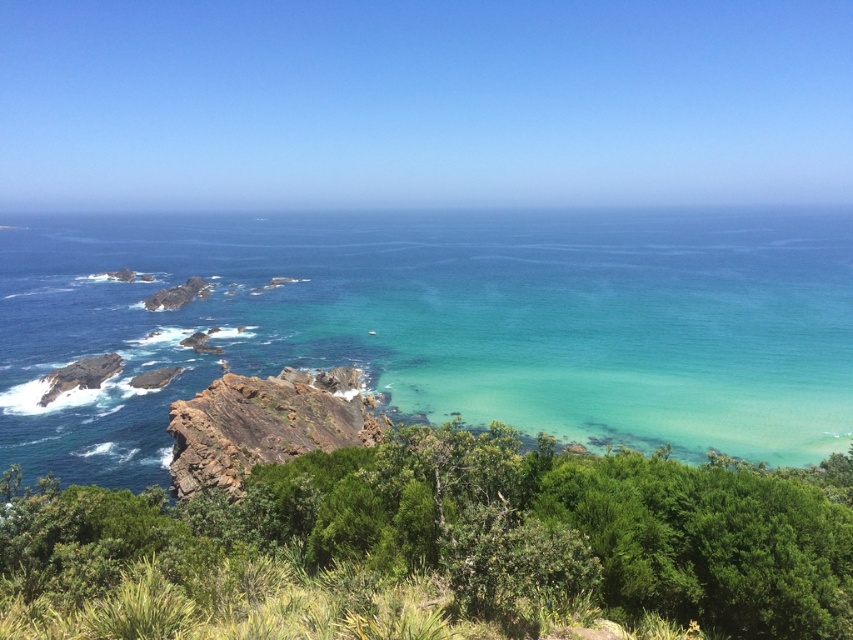
Question: Is clear blue water at center above rusty rock at center?

Choices:
 (A) yes
 (B) no

Answer: (A)

Question: Among these objects, which one is nearest to the camera?

Choices:
 (A) green leafy shrubs at lower center
 (B) clear blue water at center

Answer: (A)

Question: Estimate the real-world distances between objects in this image. Which object is closer to the green leafy shrubs at lower center?

Choices:
 (A) rusty rock at center
 (B) clear blue water at center

Answer: (A)

Question: Is clear blue water at center smaller than rusty rock at center?

Choices:
 (A) yes
 (B) no

Answer: (B)

Question: Does clear blue water at center come in front of green leafy shrubs at lower center?

Choices:
 (A) yes
 (B) no

Answer: (B)

Question: Among these points, which one is nearest to the camera?

Choices:
 (A) (657, 467)
 (B) (674, 246)
 (C) (218, 416)

Answer: (A)